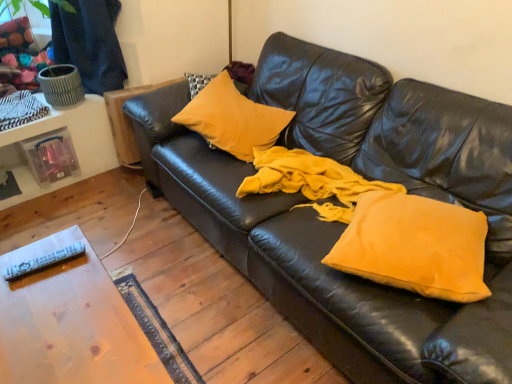
Question: Can you confirm if matte yellow pillow at center, which appears as the first pillow when viewed from the back, is bigger than wooden table at lower left?

Choices:
 (A) yes
 (B) no

Answer: (B)

Question: Is matte yellow pillow at center, the second pillow from the right, taller than wooden table at lower left?

Choices:
 (A) no
 (B) yes

Answer: (A)

Question: Is matte yellow pillow at center, the second pillow from the right, positioned beyond the bounds of wooden table at lower left?

Choices:
 (A) yes
 (B) no

Answer: (A)

Question: Considering the relative positions of matte yellow pillow at center, the second pillow from the right, and wooden table at lower left in the image provided, is matte yellow pillow at center, the second pillow from the right, to the left of wooden table at lower left from the viewer's perspective?

Choices:
 (A) yes
 (B) no

Answer: (B)

Question: Is the depth of matte yellow pillow at center, placed as the second pillow when sorted from front to back, greater than that of wooden table at lower left?

Choices:
 (A) no
 (B) yes

Answer: (B)

Question: From their relative heights in the image, would you say wooden table at lower left is taller or shorter than white plastic remote at lower left?

Choices:
 (A) short
 (B) tall

Answer: (B)

Question: Is wooden table at lower left spatially inside white plastic remote at lower left, or outside of it?

Choices:
 (A) outside
 (B) inside

Answer: (A)

Question: From the image's perspective, is wooden table at lower left located above or below white plastic remote at lower left?

Choices:
 (A) below
 (B) above

Answer: (A)

Question: Looking at the image, does wooden table at lower left seem bigger or smaller compared to white plastic remote at lower left?

Choices:
 (A) big
 (B) small

Answer: (A)

Question: From a real-world perspective, is matte yellow pillow at center, the 1th pillow positioned from the top, physically located above or below white plastic remote at lower left?

Choices:
 (A) below
 (B) above

Answer: (A)

Question: Is matte yellow pillow at center, placed as the second pillow when sorted from front to back, wider or thinner than white plastic remote at lower left?

Choices:
 (A) thin
 (B) wide

Answer: (B)

Question: In terms of size, does matte yellow pillow at center, the second pillow from the right, appear bigger or smaller than white plastic remote at lower left?

Choices:
 (A) big
 (B) small

Answer: (A)

Question: In the image, is matte yellow pillow at center, which appears as the first pillow when viewed from the back, on the left side or the right side of white plastic remote at lower left?

Choices:
 (A) left
 (B) right

Answer: (B)

Question: Would you say matte yellow pillow at center, placed as the 2th pillow when sorted from bottom to top, is to the left or to the right of matte yellow pillow at center, which is counted as the 1th pillow, starting from the front, in the picture?

Choices:
 (A) right
 (B) left

Answer: (B)

Question: From their relative heights in the image, would you say matte yellow pillow at center, the 1th pillow positioned from the top, is taller or shorter than matte yellow pillow at center, acting as the second pillow starting from the left?

Choices:
 (A) tall
 (B) short

Answer: (A)